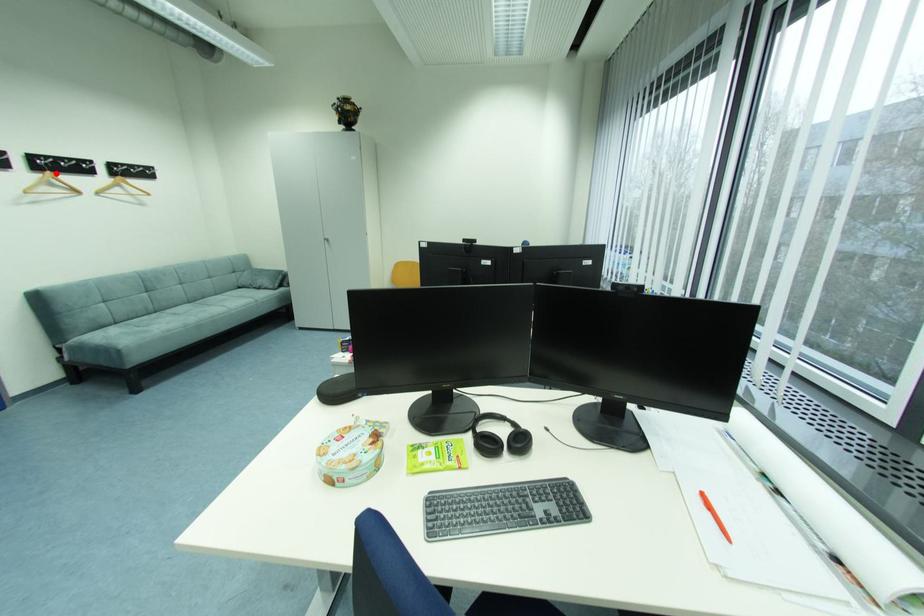
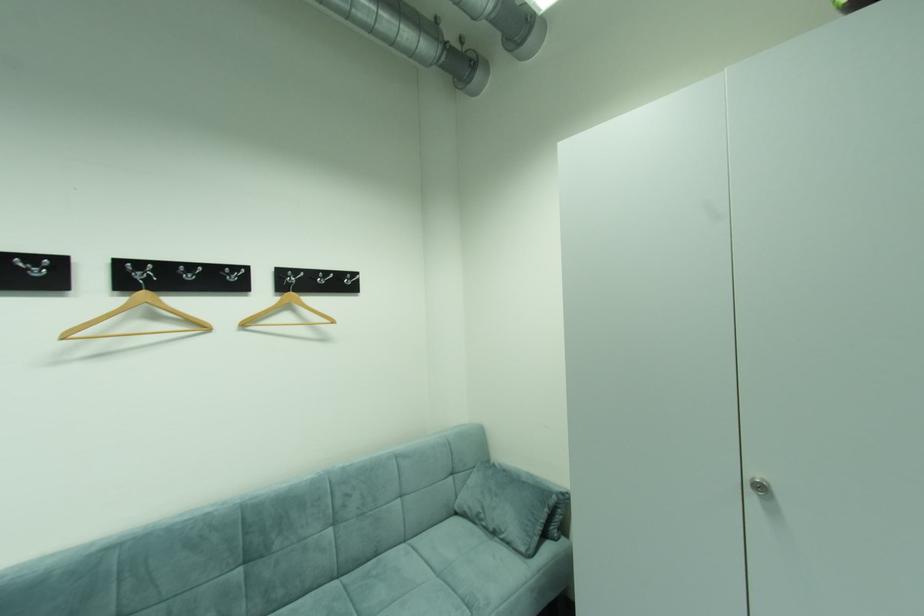
Question: I am providing you with two images of the same scene from different viewpoints. In image1, a red point is highlighted. Considering the same 3D point in image2, which of the following is correct?

Choices:
 (A) It is closer
 (B) It is farther

Answer: (A)